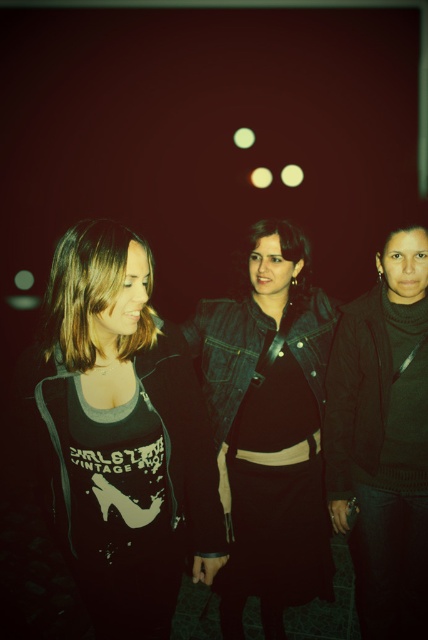
Question: Can you confirm if denim jacket at center is thinner than black matte jacket at right?

Choices:
 (A) yes
 (B) no

Answer: (B)

Question: Can you confirm if black matte t-shirt at left is thinner than denim jacket at center?

Choices:
 (A) yes
 (B) no

Answer: (A)

Question: Can you confirm if denim jacket at center is smaller than black matte jacket at right?

Choices:
 (A) no
 (B) yes

Answer: (B)

Question: Which point is closer to the camera?

Choices:
 (A) (211, 461)
 (B) (255, 467)
 (C) (327, 467)

Answer: (A)

Question: Based on their relative distances, which object is farther from the denim jacket at center?

Choices:
 (A) black matte jacket at right
 (B) black matte t-shirt at left

Answer: (B)

Question: Which point is closer to the camera?

Choices:
 (A) black matte t-shirt at left
 (B) denim jacket at center
 (C) black matte jacket at right

Answer: (A)